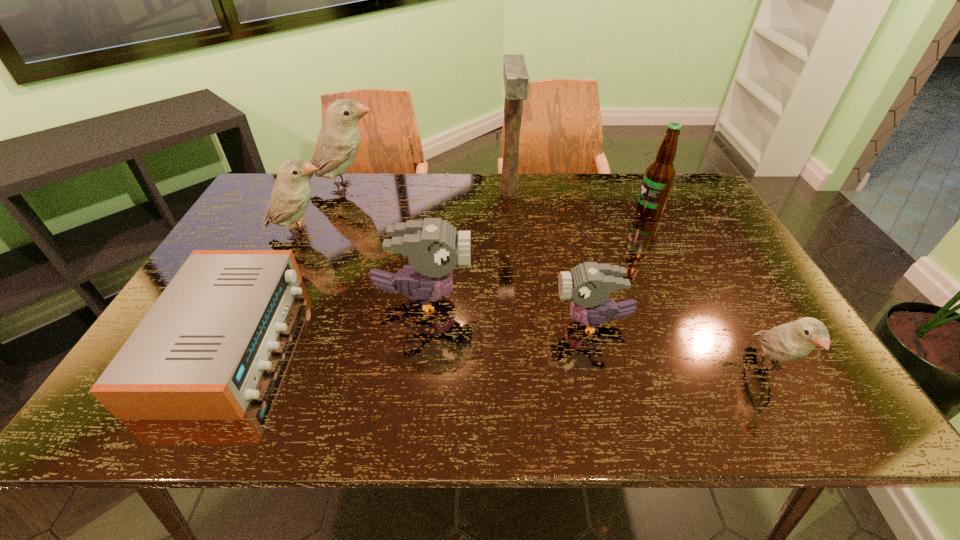
Identify the location of the rightmost object. (791, 341).

Identify the location of the rightmost bird. (791, 341).

Where is `the sixth object from left to right`? Image resolution: width=960 pixels, height=540 pixels. the sixth object from left to right is located at coordinates (589, 285).

Where is `the fourth bird from left to right`? the fourth bird from left to right is located at coordinates (589, 285).

Where is `radio receiver`? This screenshot has height=540, width=960. radio receiver is located at coordinates (198, 354).

Find the location of `vacant space located on the front of the tallest object`. vacant space located on the front of the tallest object is located at coordinates 512,218.

This screenshot has height=540, width=960. Find the location of `free space located 0.110m at the face of the farthest white bird`. free space located 0.110m at the face of the farthest white bird is located at coordinates (417, 188).

Find the location of `vacant region located 0.380m on the label of the brown beer bottle`. vacant region located 0.380m on the label of the brown beer bottle is located at coordinates (514, 213).

Identify the location of free space located 0.370m on the label of the brown beer bottle. [516, 213].

You are a GUI agent. You are given a task and a screenshot of the screen. Output one action in this format:
    pyautogui.click(x=<x>, y=<y>)
    Task: Click on the free space located on the label of the brown beer bottle
    
    Given the screenshot: What is the action you would take?
    pyautogui.click(x=578, y=213)